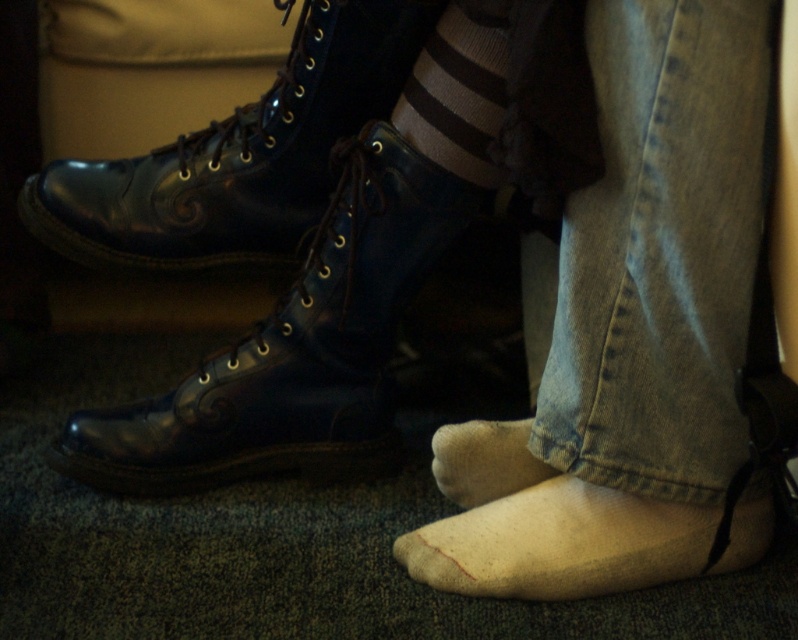
Question: Which of these objects is positioned farthest from the white fluffy sock at lower center?

Choices:
 (A) striped wool sock at center
 (B) shiny black boot at center
 (C) black leather boot at center
 (D) denim at right

Answer: (C)

Question: Is shiny black boot at center wider than black leather boot at center?

Choices:
 (A) no
 (B) yes

Answer: (B)

Question: Where is denim at right located in relation to black leather boot at center in the image?

Choices:
 (A) above
 (B) below

Answer: (B)

Question: Does shiny black boot at center have a smaller size compared to white fluffy sock at lower center?

Choices:
 (A) yes
 (B) no

Answer: (B)

Question: Which object is farther from the camera taking this photo?

Choices:
 (A) striped wool sock at center
 (B) shiny black boot at center

Answer: (B)

Question: Which object appears closest to the camera in this image?

Choices:
 (A) striped wool sock at center
 (B) black leather boot at center

Answer: (A)